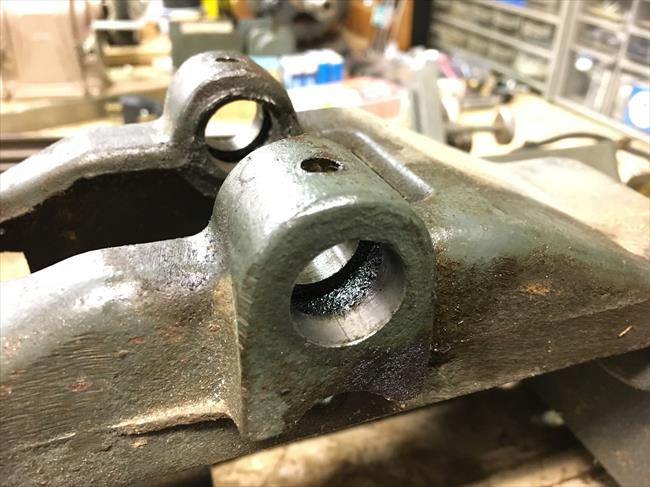
The height and width of the screenshot is (487, 650). I want to click on table, so click(413, 450), click(543, 122).